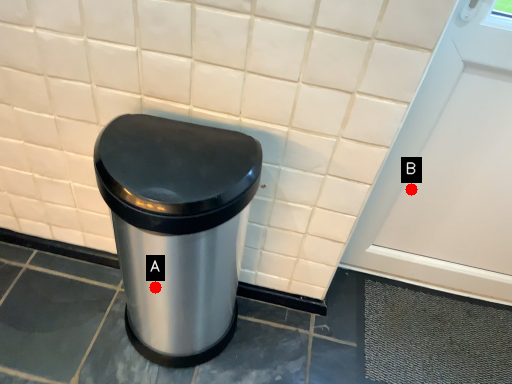
Question: Two points are circled on the image, labeled by A and B beside each circle. Which point is farther to the camera?

Choices:
 (A) A is further
 (B) B is further

Answer: (B)